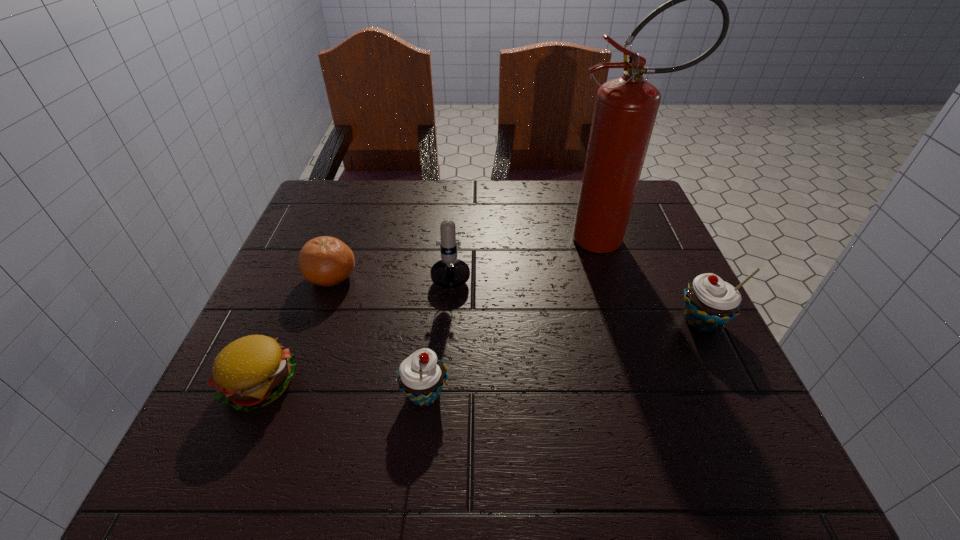
Image resolution: width=960 pixels, height=540 pixels. Find the location of `vacant space at the near left corner of the desktop`. vacant space at the near left corner of the desktop is located at coordinates [x=212, y=404].

The width and height of the screenshot is (960, 540). I want to click on free space between the clementine and the right cupcake, so click(516, 299).

This screenshot has height=540, width=960. In order to click on free space between the hamburger and the tallest object in this screenshot , I will do `click(436, 312)`.

Identify the location of free area in between the clementine and the right cupcake. The width and height of the screenshot is (960, 540). (516, 299).

The height and width of the screenshot is (540, 960). In order to click on empty space that is in between the hamburger and the microphone in this screenshot , I will do (356, 324).

The image size is (960, 540). In order to click on free space between the clementine and the microphone in this screenshot , I will do `click(392, 270)`.

Find the location of a particular element. This screenshot has width=960, height=540. vacant area that lies between the fire extinguisher and the clementine is located at coordinates (470, 258).

I want to click on vacant point located between the right cupcake and the tallest object, so click(656, 280).

I want to click on free space between the tallest object and the clementine, so click(470, 258).

Identify the location of free space between the clementine and the shorter cupcake. (378, 335).